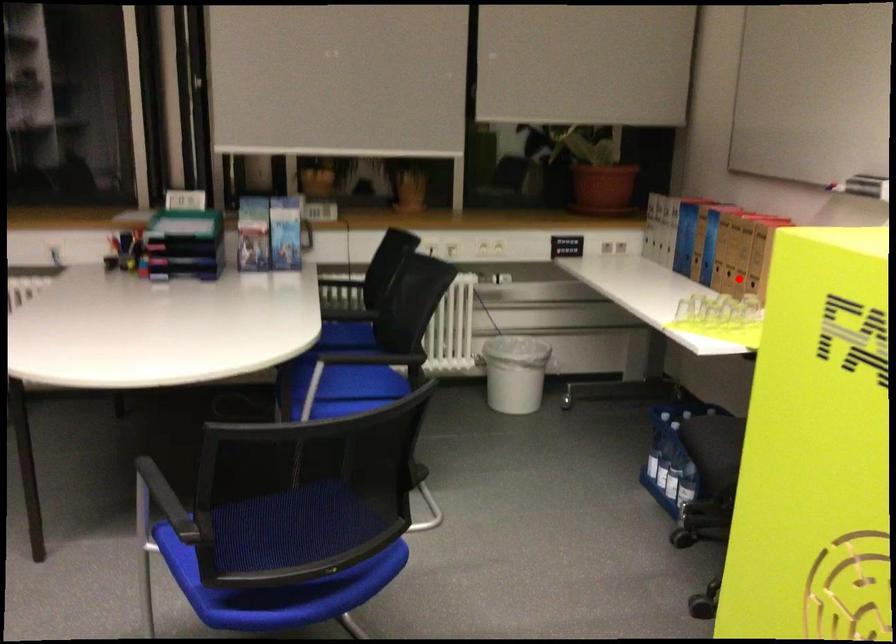
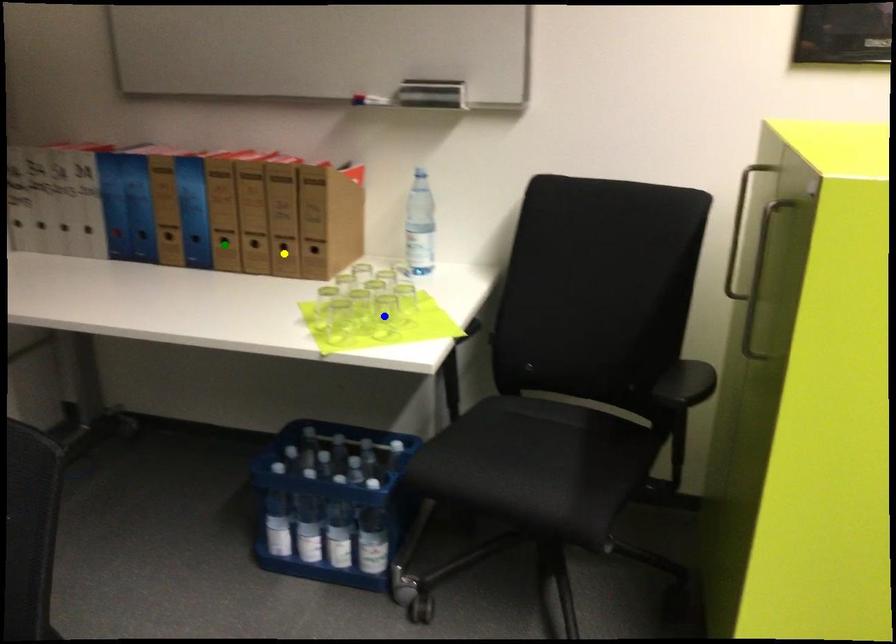
Question: I am providing you with two images of the same scene from different viewpoints. A red point is marked on the first image. You are given multiple points on the second image. Which point in image 2 represents the same 3d spot as the red point in image 1?

Choices:
 (A) green point
 (B) yellow point
 (C) blue point

Answer: (B)